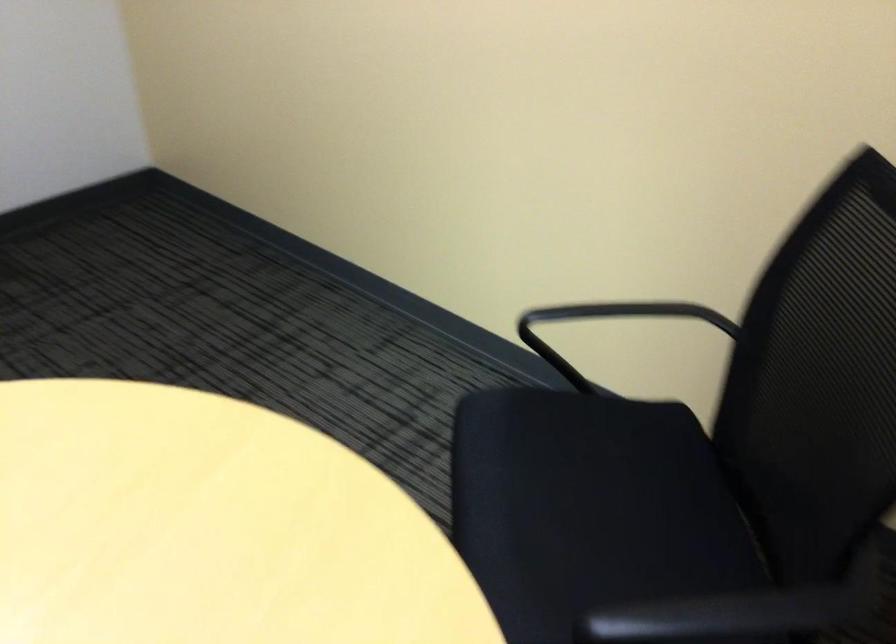
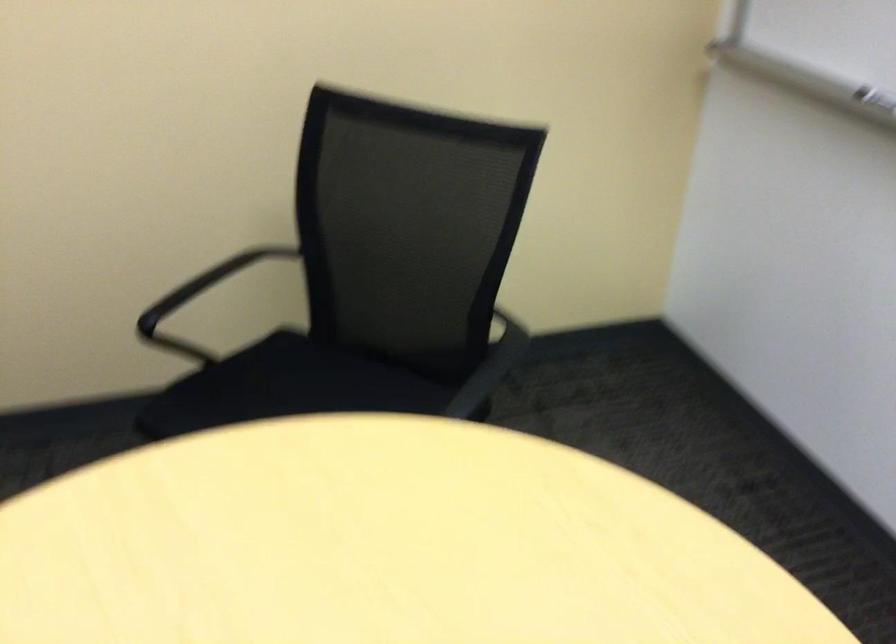
The point at (538, 440) is marked in the first image. Where is the corresponding point in the second image?

(231, 402)